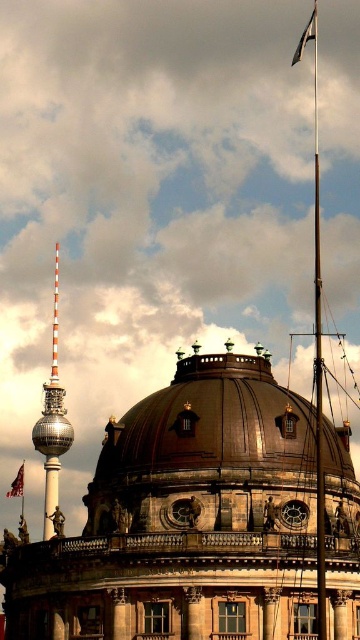
You are a photographer planning to capture the historic building and its flagpole. You want to ensure both the shiny gold dome at center and the white fabric flag at upper right are clearly visible in your shot. Given their sizes, which one should you focus on first to ensure it fits within the frame?

The shiny gold dome at center is much taller than the white fabric flag at upper right, so you should focus on framing the dome first to ensure it fits, as it is the larger object.

You are an architect visiting the historic building and want to take a photo of both the shiny gold dome at center and the red fabric flag at upper center. However, your camera can only focus on objects within a 10 meter height range. The dome is 50 meters tall. Can you capture both in one shot without adjusting your camera settings?

The shiny gold dome at center is taller than the red fabric flag at upper center. Since the dome is 50 meters tall, the flag must be shorter than 50 meters. The height difference between them is less than 10 meters, so yes, both can be captured in one shot as they fall within the 10 meter focus range.

You are a photographer planning to take a picture of the historic building with its flagpole and flag. You want to ensure that both the red fabric flag at upper center and the metallic flag pole at upper center are clearly visible in your shot. Based on their sizes, could the flag potentially obscure the pole in the photo?

The red fabric flag at upper center might be wider than the metallic flag pole at upper center, so there is a possibility that the flag could partially obscure the pole in the photo depending on the angle and distance.